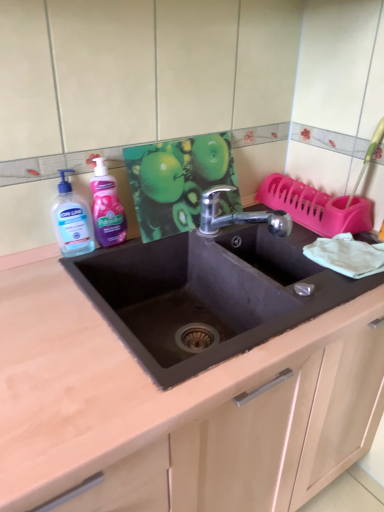
Question: Considering the relative positions of transparent liquid soap at left, positioned as the 2th cleaning product in right-to-left order, and pink glossy liquid soap at left, the 1th cleaning product from the right, in the image provided, is transparent liquid soap at left, positioned as the 2th cleaning product in right-to-left order, to the left or to the right of pink glossy liquid soap at left, the 1th cleaning product from the right,?

Choices:
 (A) right
 (B) left

Answer: (B)

Question: Is transparent liquid soap at left, positioned as the 2th cleaning product in right-to-left order, spatially inside pink glossy liquid soap at left, the 2th cleaning product positioned from the left, or outside of it?

Choices:
 (A) outside
 (B) inside

Answer: (A)

Question: Estimate the real-world distances between objects in this image. Which object is farther from the black matte sink at center?

Choices:
 (A) transparent liquid soap at left, acting as the first cleaning product starting from the left
 (B) black matte sink at center
 (C) pink glossy liquid soap at left, the 1th cleaning product from the right

Answer: (B)

Question: Based on their relative distances, which object is nearer to the pink glossy liquid soap at left, the 1th cleaning product from the right?

Choices:
 (A) black matte sink at center
 (B) transparent liquid soap at left, acting as the first cleaning product starting from the left
 (C) black matte sink at center

Answer: (B)